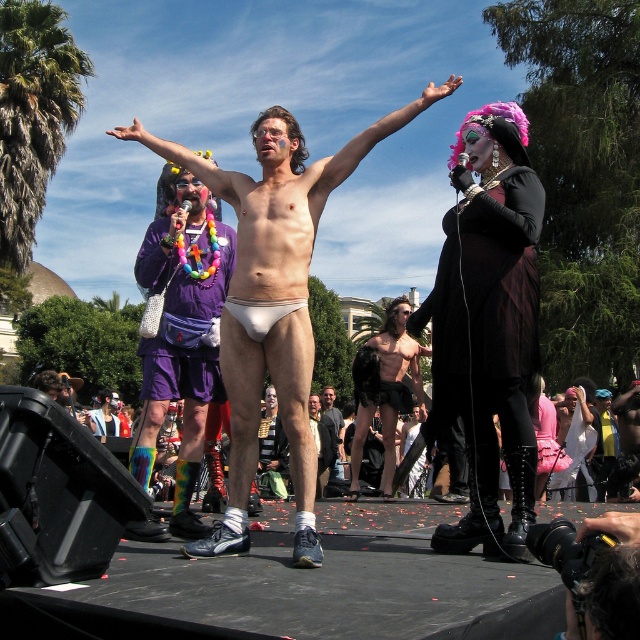
Question: Is purple fabric shorts at left bigger than shiny black shorts at center?

Choices:
 (A) yes
 (B) no

Answer: (B)

Question: Which object is positioned closest to the black leather dress at center?

Choices:
 (A) smooth black shorts at center
 (B) purple fabric lei at left
 (C) white matte underwear at center

Answer: (C)

Question: Which of the following is the farthest from the observer?

Choices:
 (A) purple fabric lei at left
 (B) smooth white underwear at center

Answer: (A)

Question: Based on their relative distances, which object is farther from the smooth black shorts at center?

Choices:
 (A) black leather dress at center
 (B) purple fabric lei at left
 (C) shiny black shorts at center

Answer: (A)

Question: Where is purple fabric shorts at left located in relation to shiny black shorts at center in the image?

Choices:
 (A) left
 (B) right

Answer: (A)

Question: Does black leather dress at center have a lesser width compared to smooth black shorts at center?

Choices:
 (A) no
 (B) yes

Answer: (A)